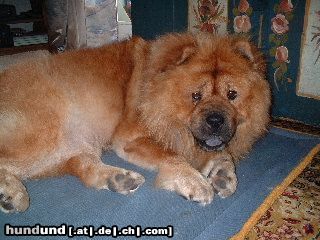
Find the location of a particular element. The image size is (320, 240). blanket is located at coordinates (151, 202).